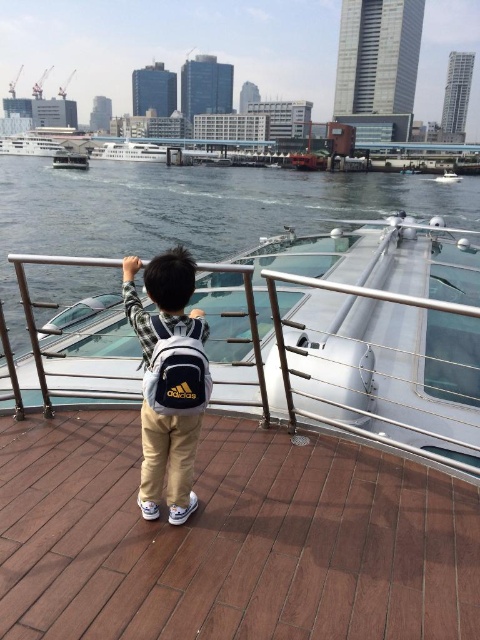
You are standing on the wooden deck and want to board the white glossy boat at center. The boat is 8.15 feet away from you. If your reach is 2 feet, can you grab the boat without moving closer?

The white glossy boat at center is 8.15 feet away from the viewer. Since your reach is only 2 feet, you cannot grab the boat without moving closer.

Based on the photo, you are standing on the brown wooden deck at center and want to move towards the khaki cotton pants at center. Which direction should you move?

You should move to the right because the khaki cotton pants at center is to the right of the brown wooden deck at center.